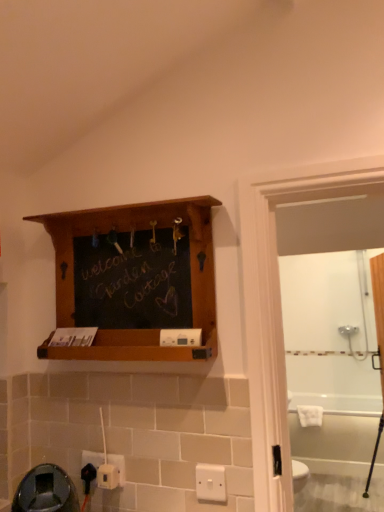
Question: Can you confirm if white glossy bathtub at lower right is wider than white plastic electric outlet at lower left, placed as the second electric outlet when sorted from back to front?

Choices:
 (A) yes
 (B) no

Answer: (A)

Question: Does white glossy bathtub at lower right appear on the right side of white plastic electric outlet at lower left, the second electric outlet positioned from the front?

Choices:
 (A) no
 (B) yes

Answer: (B)

Question: Is white glossy bathtub at lower right positioned behind white plastic electric outlet at lower left, placed as the second electric outlet when sorted from back to front?

Choices:
 (A) yes
 (B) no

Answer: (A)

Question: Is white glossy bathtub at lower right at the left side of white plastic electric outlet at lower left, placed as the second electric outlet when sorted from back to front?

Choices:
 (A) yes
 (B) no

Answer: (B)

Question: Is white glossy bathtub at lower right not near white plastic electric outlet at lower left, the second electric outlet positioned from the front?

Choices:
 (A) no
 (B) yes

Answer: (B)

Question: Relative to white plastic electric outlet at lower left, positioned as the 1th electric outlet in back-to-front order, is white plastic electric outlet at lower left, placed as the second electric outlet when sorted from back to front, in front or behind?

Choices:
 (A) front
 (B) behind

Answer: (A)

Question: From the image's perspective, relative to white plastic electric outlet at lower left, positioned as the 1th electric outlet in back-to-front order, is white plastic electric outlet at lower left, the second electric outlet positioned from the front, above or below?

Choices:
 (A) above
 (B) below

Answer: (A)

Question: Considering the positions of white plastic electric outlet at lower left, placed as the second electric outlet when sorted from back to front, and white plastic electric outlet at lower left, positioned as the 1th electric outlet in back-to-front order, in the image, is white plastic electric outlet at lower left, placed as the second electric outlet when sorted from back to front, taller or shorter than white plastic electric outlet at lower left, positioned as the 1th electric outlet in back-to-front order,?

Choices:
 (A) short
 (B) tall

Answer: (B)

Question: In terms of width, does white plastic electric outlet at lower left, placed as the second electric outlet when sorted from back to front, look wider or thinner when compared to white plastic electric outlet at lower left, the 3th electric outlet viewed from the front?

Choices:
 (A) thin
 (B) wide

Answer: (A)

Question: Considering their positions, is white glossy bathtub at lower right located in front of or behind white plastic electric outlet at lower left, the second electric outlet positioned from the front?

Choices:
 (A) behind
 (B) front

Answer: (A)

Question: From a real-world perspective, is white glossy bathtub at lower right above or below white plastic electric outlet at lower left, placed as the second electric outlet when sorted from back to front?

Choices:
 (A) below
 (B) above

Answer: (A)

Question: From the image's perspective, is white glossy bathtub at lower right above or below white plastic electric outlet at lower left, placed as the second electric outlet when sorted from back to front?

Choices:
 (A) above
 (B) below

Answer: (B)

Question: Considering the positions of white glossy bathtub at lower right and white plastic electric outlet at lower left, the second electric outlet positioned from the front, in the image, is white glossy bathtub at lower right bigger or smaller than white plastic electric outlet at lower left, the second electric outlet positioned from the front,?

Choices:
 (A) big
 (B) small

Answer: (A)

Question: Based on their sizes in the image, would you say white plastic electric outlet at lower left, the second electric outlet positioned from the front, is bigger or smaller than white glossy bathtub at lower right?

Choices:
 (A) small
 (B) big

Answer: (A)

Question: Considering the positions of white plastic electric outlet at lower left, the second electric outlet positioned from the front, and white glossy bathtub at lower right in the image, is white plastic electric outlet at lower left, the second electric outlet positioned from the front, wider or thinner than white glossy bathtub at lower right?

Choices:
 (A) wide
 (B) thin

Answer: (B)